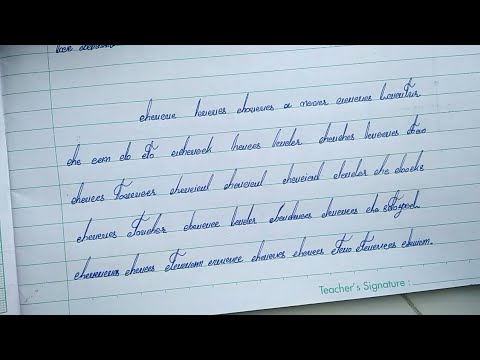
Find the location of a particular element. This screenshot has height=360, width=480. column is located at coordinates (46, 176).